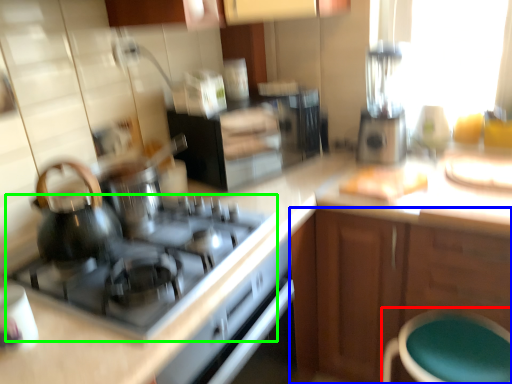
Question: Based on their relative distances, which object is farther from bar stool (highlighted by a red box)? Choose from cabinetry (highlighted by a blue box) and gas stove (highlighted by a green box).

Choices:
 (A) cabinetry
 (B) gas stove

Answer: (B)